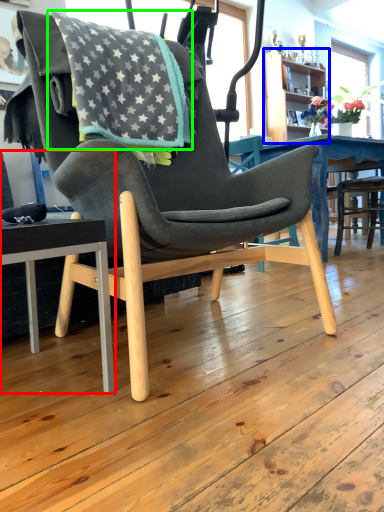
Question: Which object is the closest to the chair (highlighted by a red box)? Choose among these: bookshelf (highlighted by a blue box) or blanket (highlighted by a green box).

Choices:
 (A) bookshelf
 (B) blanket

Answer: (B)